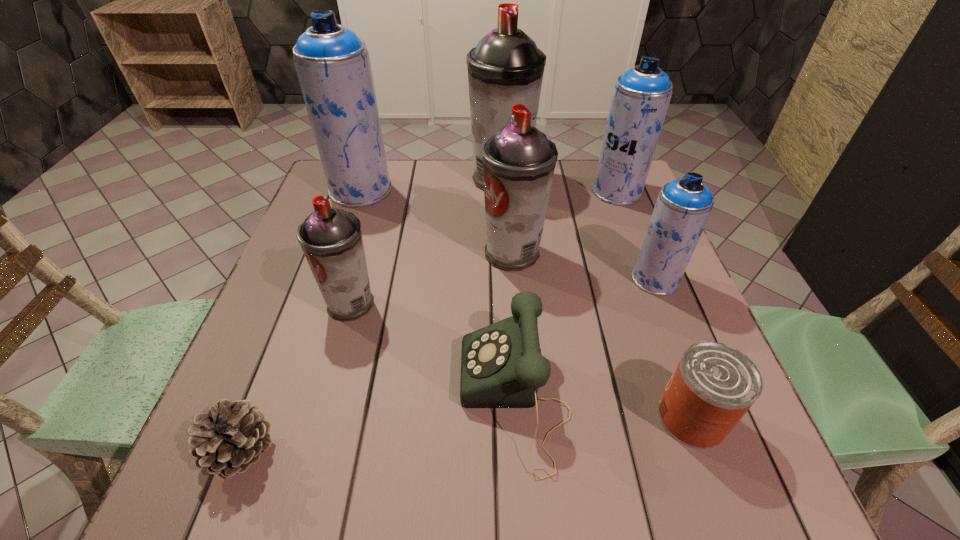
Where is `free space between the leftmost blue aerosol can and the farthest gray aerosol can`? Image resolution: width=960 pixels, height=540 pixels. free space between the leftmost blue aerosol can and the farthest gray aerosol can is located at coordinates (431, 184).

The width and height of the screenshot is (960, 540). I want to click on free space between the pinecone and the smallest gray aerosol can, so click(x=296, y=377).

Select which object is the closest to the second smallest blue aerosol can. Please provide its 2D coordinates. Your answer should be formatted as a tuple, i.e. [(x, y)], where the tuple contains the x and y coordinates of a point satisfying the conditions above.

[(506, 68)]

I want to click on the second closest object to the can, so click(x=683, y=206).

Where is `the closest aerosol can to the second biggest gray aerosol can`? This screenshot has width=960, height=540. the closest aerosol can to the second biggest gray aerosol can is located at coordinates (506, 68).

Point out which aerosol can is positioned as the nearest to the farthest gray aerosol can. Please provide its 2D coordinates. Your answer should be formatted as a tuple, i.e. [(x, y)], where the tuple contains the x and y coordinates of a point satisfying the conditions above.

[(519, 161)]

Point out which gray aerosol can is positioned as the nearest to the smallest blue aerosol can. Please provide its 2D coordinates. Your answer should be formatted as a tuple, i.e. [(x, y)], where the tuple contains the x and y coordinates of a point satisfying the conditions above.

[(519, 161)]

Locate an element on the screen. The image size is (960, 540). the third closest gray aerosol can to the can is located at coordinates (506, 68).

Locate an element on the screen. blue aerosol can that can be found as the second closest to the farthest gray aerosol can is located at coordinates (333, 65).

This screenshot has width=960, height=540. Identify the location of the closest blue aerosol can to the nearest blue aerosol can. (641, 96).